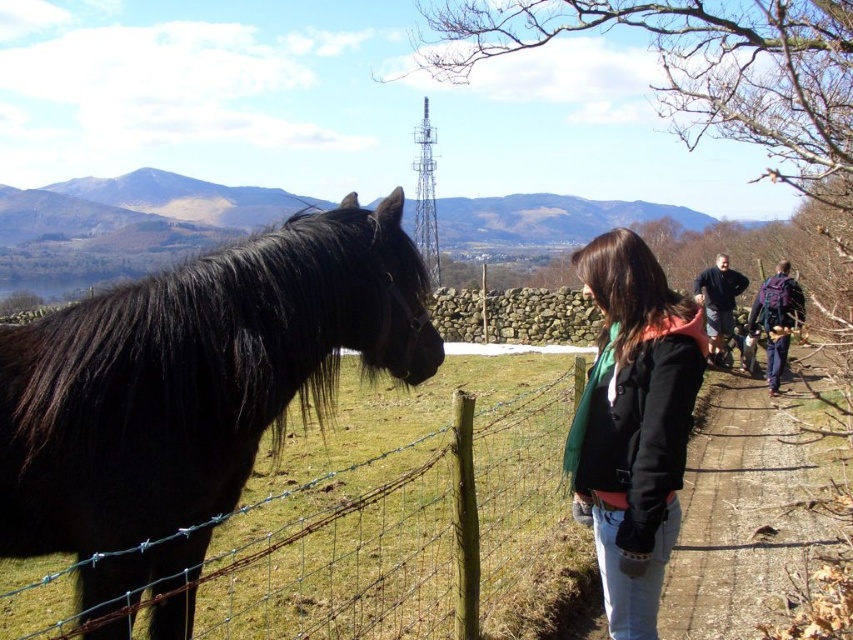
You are a photographer trying to capture the black fleece jacket at center in your shot. The camera you are using has a sensor that can detect objects within a 0.5 radius around the center point. Will the jacket be within the camera sensor range?

The black fleece jacket at center is positioned at point (634, 422). The camera sensor has a radius of 0.5 around the center. Since the distance from the center to the jacket is sqrt. The distance from the center to the jacket is sqrt. The distance from the center to the jacket is sqrt. The distance from the center to the jacket is sqrt. The distance from the center to the jacket is sqrt. The distance from the center to the jacket is sqrt. The distance from the center to the jacket is sqrt. The distance.